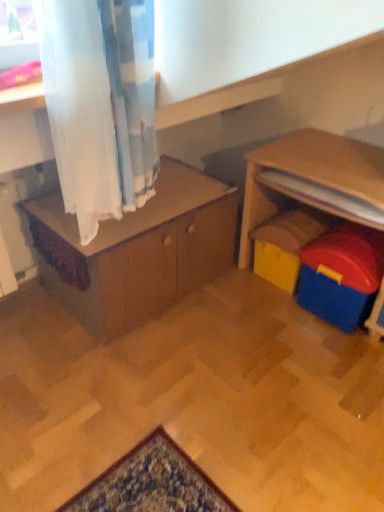
The width and height of the screenshot is (384, 512). What do you see at coordinates (285, 244) in the screenshot?
I see `yellow plastic toy at lower right, the second toy in the front-to-back sequence` at bounding box center [285, 244].

Describe the element at coordinates (341, 275) in the screenshot. I see `blue plastic toy at right, the second toy when ordered from back to front` at that location.

Where is `yellow plastic toy at lower right, the second toy in the front-to-back sequence`? The height and width of the screenshot is (512, 384). yellow plastic toy at lower right, the second toy in the front-to-back sequence is located at coordinates (285, 244).

At what (x,y) coordinates should I click in order to perform the action: click on toy in front of the yellow plastic toy at lower right, which appears as the 1th toy when viewed from the back. Please return your answer as a coordinate pair (x, y). Image resolution: width=384 pixels, height=512 pixels. Looking at the image, I should click on (341, 275).

Is point (276, 267) positioned after point (380, 257)?

Yes, it is.

Are yellow plastic toy at lower right, the second toy in the front-to-back sequence, and blue plastic toy at right, which ranks as the 1th toy in front-to-back order, making contact?

No, yellow plastic toy at lower right, the second toy in the front-to-back sequence, is not making contact with blue plastic toy at right, which ranks as the 1th toy in front-to-back order.

From the picture: Who is shorter, yellow plastic toy at lower right, which appears as the 1th toy when viewed from the back, or blue plastic toy at right, which ranks as the 1th toy in front-to-back order?

With less height is yellow plastic toy at lower right, which appears as the 1th toy when viewed from the back.

Consider the image. From the image's perspective, is blue plastic toy at right, the second toy when ordered from back to front, over yellow plastic toy at lower right, which appears as the 1th toy when viewed from the back?

Actually, blue plastic toy at right, the second toy when ordered from back to front, appears below yellow plastic toy at lower right, which appears as the 1th toy when viewed from the back, in the image.

Considering the relative sizes of blue plastic toy at right, which ranks as the 1th toy in front-to-back order, and yellow plastic toy at lower right, the second toy in the front-to-back sequence, in the image provided, is blue plastic toy at right, which ranks as the 1th toy in front-to-back order, shorter than yellow plastic toy at lower right, the second toy in the front-to-back sequence,?

In fact, blue plastic toy at right, which ranks as the 1th toy in front-to-back order, may be taller than yellow plastic toy at lower right, the second toy in the front-to-back sequence.

Are blue plastic toy at right, which ranks as the 1th toy in front-to-back order, and yellow plastic toy at lower right, the second toy in the front-to-back sequence, located far from each other?

blue plastic toy at right, which ranks as the 1th toy in front-to-back order, is near yellow plastic toy at lower right, the second toy in the front-to-back sequence, not far away.

Is wooden cabinet at center directly adjacent to blue plastic toy at right, the second toy when ordered from back to front?

No, wooden cabinet at center is not beside blue plastic toy at right, the second toy when ordered from back to front.

From the image's perspective, is wooden cabinet at center located above or below blue plastic toy at right, which ranks as the 1th toy in front-to-back order?

From the image's perspective, wooden cabinet at center appears above blue plastic toy at right, which ranks as the 1th toy in front-to-back order.

Can you confirm if wooden cabinet at center is taller than blue plastic toy at right, which ranks as the 1th toy in front-to-back order?

Yes.

Can you tell me how much wooden cabinet at center and blue plastic toy at right, the second toy when ordered from back to front, differ in facing direction?

The facing directions of wooden cabinet at center and blue plastic toy at right, the second toy when ordered from back to front, are 89 degrees apart.

Is blue plastic toy at right, which ranks as the 1th toy in front-to-back order, surrounding wooden cabinet at center?

No.

Can you confirm if blue plastic toy at right, the second toy when ordered from back to front, is smaller than wooden cabinet at center?

Indeed, blue plastic toy at right, the second toy when ordered from back to front, has a smaller size compared to wooden cabinet at center.

From a real-world perspective, is blue plastic toy at right, the second toy when ordered from back to front, on top of wooden cabinet at center?

Incorrect, from a real-world perspective, blue plastic toy at right, the second toy when ordered from back to front, is lower than wooden cabinet at center.

From a real-world perspective, is wooden cabinet at center physically located above or below yellow plastic toy at lower right, the second toy in the front-to-back sequence?

wooden cabinet at center is above yellow plastic toy at lower right, the second toy in the front-to-back sequence.

Is wooden cabinet at center positioned in front of yellow plastic toy at lower right, the second toy in the front-to-back sequence?

Yes, it is.

Considering the relative sizes of wooden cabinet at center and yellow plastic toy at lower right, the second toy in the front-to-back sequence, in the image provided, is wooden cabinet at center bigger than yellow plastic toy at lower right, the second toy in the front-to-back sequence,?

Correct, wooden cabinet at center is larger in size than yellow plastic toy at lower right, the second toy in the front-to-back sequence.

From the image's perspective, is wooden cabinet at center above yellow plastic toy at lower right, the second toy in the front-to-back sequence?

Yes, from the image's perspective, wooden cabinet at center is over yellow plastic toy at lower right, the second toy in the front-to-back sequence.

How far apart are yellow plastic toy at lower right, the second toy in the front-to-back sequence, and wooden cabinet at center?

yellow plastic toy at lower right, the second toy in the front-to-back sequence, is 58.06 centimeters from wooden cabinet at center.

Considering the sizes of yellow plastic toy at lower right, which appears as the 1th toy when viewed from the back, and wooden cabinet at center in the image, is yellow plastic toy at lower right, which appears as the 1th toy when viewed from the back, bigger or smaller than wooden cabinet at center?

Clearly, yellow plastic toy at lower right, which appears as the 1th toy when viewed from the back, is smaller in size than wooden cabinet at center.

Is point (285, 268) positioned before point (227, 186)?

Yes.

Identify the location of toy lying below the yellow plastic toy at lower right, the second toy in the front-to-back sequence (from the image's perspective). The image size is (384, 512). (341, 275).

Locate an element on the screen. toy above the blue plastic toy at right, which ranks as the 1th toy in front-to-back order (from the image's perspective) is located at coordinates (285, 244).

In the scene shown: When comparing their distances from yellow plastic toy at lower right, which appears as the 1th toy when viewed from the back, does wooden cabinet at center or blue plastic toy at right, which ranks as the 1th toy in front-to-back order, seem further?

Based on the image, wooden cabinet at center appears to be further to yellow plastic toy at lower right, which appears as the 1th toy when viewed from the back.

Estimate the real-world distances between objects in this image. Which object is closer to wooden cabinet at center, yellow plastic toy at lower right, the second toy in the front-to-back sequence, or blue plastic toy at right, the second toy when ordered from back to front?

yellow plastic toy at lower right, the second toy in the front-to-back sequence, is closer to wooden cabinet at center.

Looking at the image, which one is located closer to yellow plastic toy at lower right, the second toy in the front-to-back sequence, blue plastic toy at right, which ranks as the 1th toy in front-to-back order, or wooden cabinet at center?

blue plastic toy at right, which ranks as the 1th toy in front-to-back order.

Based on the photo, when comparing their distances from blue plastic toy at right, the second toy when ordered from back to front, does yellow plastic toy at lower right, which appears as the 1th toy when viewed from the back, or wooden cabinet at center seem closer?

Among the two, yellow plastic toy at lower right, which appears as the 1th toy when viewed from the back, is located nearer to blue plastic toy at right, the second toy when ordered from back to front.

From the image, which object appears to be nearer to blue plastic toy at right, the second toy when ordered from back to front, wooden cabinet at center or yellow plastic toy at lower right, which appears as the 1th toy when viewed from the back?

yellow plastic toy at lower right, which appears as the 1th toy when viewed from the back, is closer to blue plastic toy at right, the second toy when ordered from back to front.

From the image, which object appears to be nearer to wooden cabinet at center, blue plastic toy at right, which ranks as the 1th toy in front-to-back order, or yellow plastic toy at lower right, which appears as the 1th toy when viewed from the back?

yellow plastic toy at lower right, which appears as the 1th toy when viewed from the back.

Identify the location of toy located between wooden cabinet at center and blue plastic toy at right, the second toy when ordered from back to front, in the left-right direction. Image resolution: width=384 pixels, height=512 pixels. (285, 244).